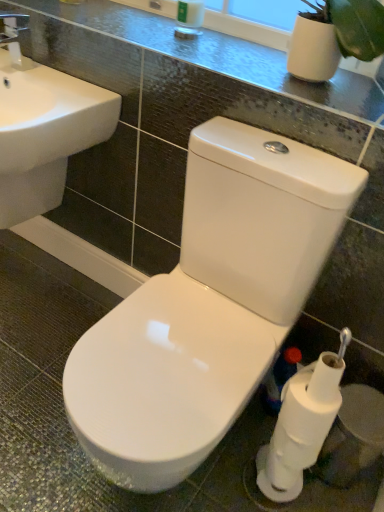
Question: Is point (251, 64) closer or farther from the camera than point (100, 373)?

Choices:
 (A) closer
 (B) farther

Answer: (B)

Question: Relative to white glossy toilet at center, is glossy ceramic counter top at upper center in front or behind?

Choices:
 (A) behind
 (B) front

Answer: (A)

Question: Considering the real-world distances, which object is closest to the glossy ceramic counter top at upper center?

Choices:
 (A) white glossy toilet at center
 (B) white matte toilet paper at lower right, which is counted as the second toilet paper, starting from the top
 (C) white ceramic sink at left
 (D) white matte toilet paper at lower right, the 1th toilet paper viewed from the top

Answer: (C)

Question: Which object is the farthest from the white matte toilet paper at lower right, which is counted as the 1th toilet paper, starting from the bottom?

Choices:
 (A) white ceramic sink at left
 (B) glossy ceramic counter top at upper center
 (C) white matte toilet paper at lower right, the 1th toilet paper viewed from the top
 (D) white glossy toilet at center

Answer: (A)